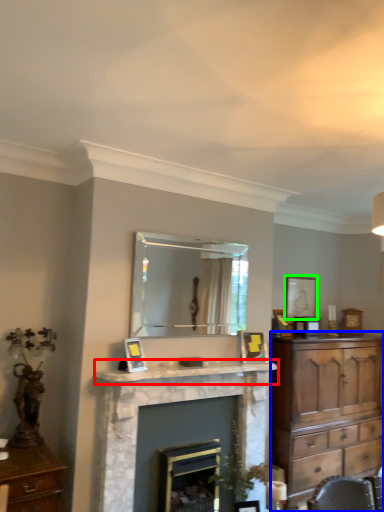
Question: Which object is the farthest from mantle (highlighted by a red box)? Choose among these: chest of drawers (highlighted by a blue box) or picture frame (highlighted by a green box).

Choices:
 (A) chest of drawers
 (B) picture frame

Answer: (B)